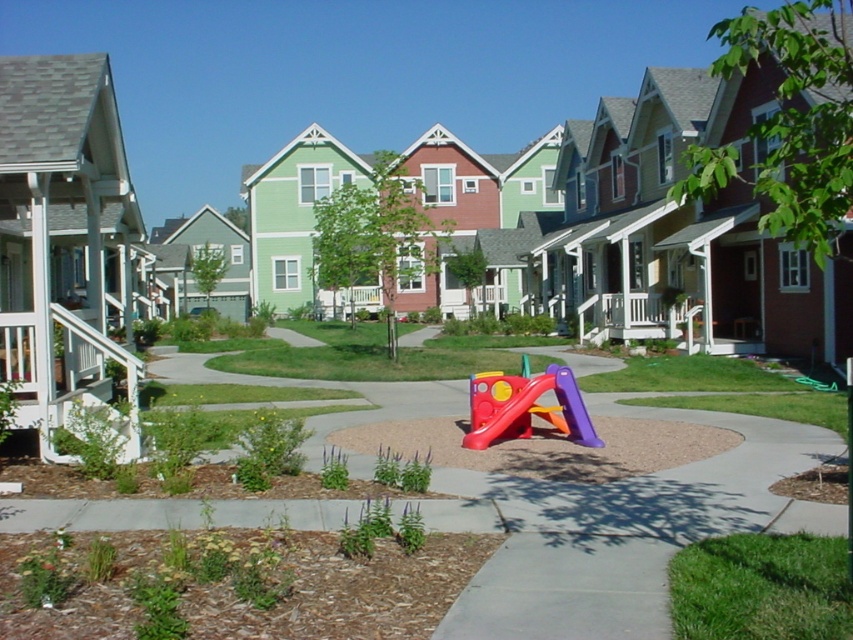
Which of these two, rubberized plastic slide at center or white painted wood porch at lower left, stands taller?

white painted wood porch at lower left is taller.

Who is more distant from viewer, (520, 424) or (108, 339)?

The point (520, 424) is behind.

What are the coordinates of `rubberized plastic slide at center` in the screenshot? It's located at (525, 406).